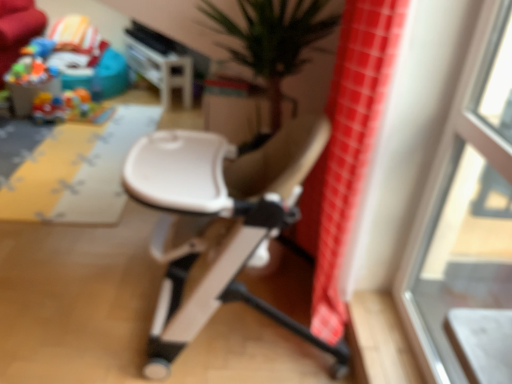
Question: Is red checkered fabric at right in front of or behind transparent glass window at upper right in the image?

Choices:
 (A) front
 (B) behind

Answer: (B)

Question: Is red checkered fabric at right inside or outside of transparent glass window at upper right?

Choices:
 (A) outside
 (B) inside

Answer: (A)

Question: Which object is the farthest from the transparent glass window at upper right?

Choices:
 (A) white plastic table at upper center
 (B) plastic colorful toys at upper left
 (C) red checkered fabric at right
 (D) white plastic chair at center
 (E) yellow fabric play mat at left

Answer: (B)

Question: Estimate the real-world distances between objects in this image. Which object is farther from the white plastic table at upper center?

Choices:
 (A) white plastic chair at center
 (B) red checkered fabric at right
 (C) transparent glass window at upper right
 (D) yellow fabric play mat at left
 (E) plastic colorful toys at upper left

Answer: (C)